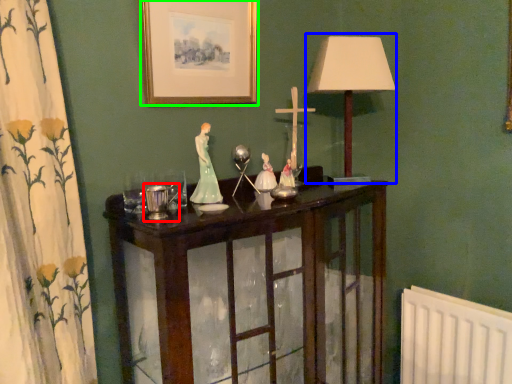
Question: Which object is the farthest from candle holder (highlighted by a red box)? Choose among these: table lamp (highlighted by a blue box) or picture frame (highlighted by a green box).

Choices:
 (A) table lamp
 (B) picture frame

Answer: (A)